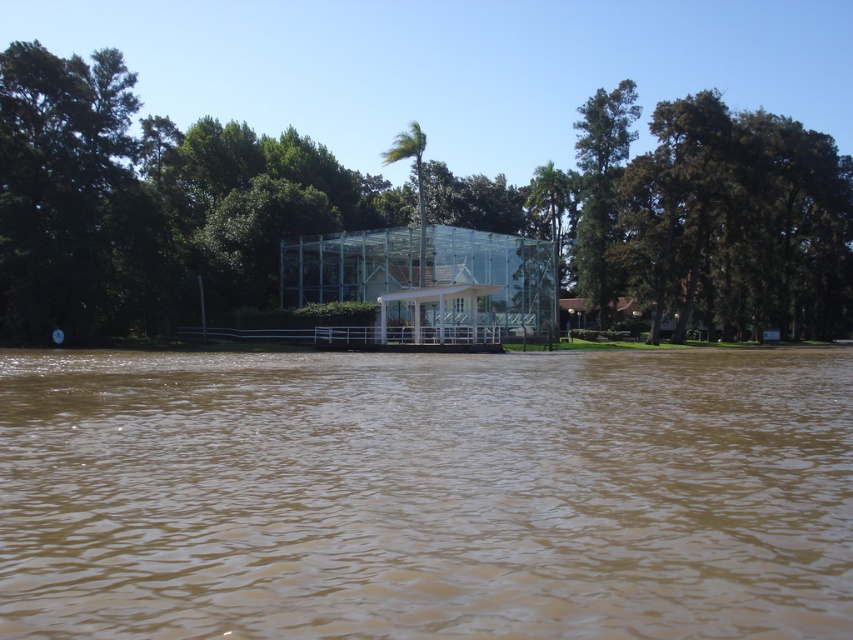
Is brown muddy water at center above green leafy tree at upper right?

Actually, brown muddy water at center is below green leafy tree at upper right.

Between point (19, 563) and point (612, 157), which one is positioned behind?

Point (612, 157)

Locate an element on the screen. This screenshot has height=640, width=853. brown muddy water at center is located at coordinates tap(426, 493).

Is brown muddy water at center positioned before green leafy tree at center?

Yes, it is.

Is point (538, 372) farther from camera compared to point (15, 148)?

No, it is in front of (15, 148).

Between point (550, 522) and point (838, 310), which one is positioned in front?

Point (550, 522) is more forward.

This screenshot has width=853, height=640. What are the coordinates of `brown muddy water at center` in the screenshot? It's located at (426, 493).

Is green leafy tree at center positioned at the back of green leafy tree at upper right?

No, it is in front of green leafy tree at upper right.

Identify the location of green leafy tree at center. (149, 204).